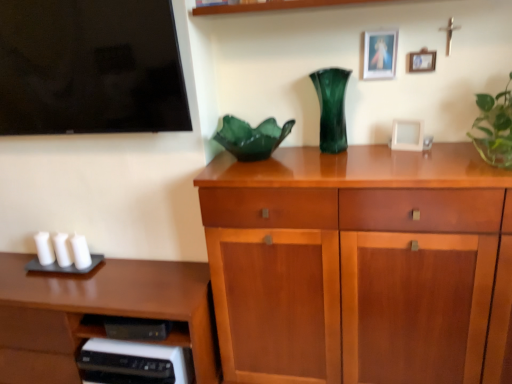
This screenshot has width=512, height=384. I want to click on vacant space that is in between green glossy plant at right, which is the second houseplant in left-to-right order, and white matte picture frame at upper right, marked as the 1th picture frame in a bottom-to-top arrangement, so click(438, 152).